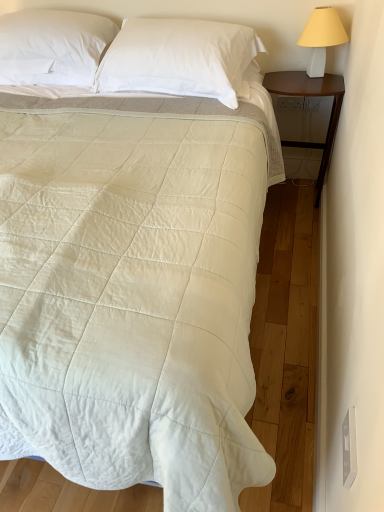
Question: From the image's perspective, is white smooth pillow at upper center, marked as the second pillow in a left-to-right arrangement, on white quilted fabric bed at center?

Choices:
 (A) yes
 (B) no

Answer: (A)

Question: From the image's perspective, is white smooth pillow at upper center, marked as the second pillow in a left-to-right arrangement, beneath white quilted fabric bed at center?

Choices:
 (A) no
 (B) yes

Answer: (A)

Question: Can you confirm if white smooth pillow at upper center, which ranks as the 1th pillow in right-to-left order, is taller than white quilted fabric bed at center?

Choices:
 (A) yes
 (B) no

Answer: (B)

Question: Does white smooth pillow at upper center, which ranks as the 1th pillow in right-to-left order, have a lesser height compared to white quilted fabric bed at center?

Choices:
 (A) yes
 (B) no

Answer: (A)

Question: Does white smooth pillow at upper center, marked as the second pillow in a left-to-right arrangement, have a smaller size compared to white quilted fabric bed at center?

Choices:
 (A) yes
 (B) no

Answer: (A)

Question: In terms of size, does white smooth pillow at upper center, acting as the second pillow starting from the right, appear bigger or smaller than white quilted fabric bed at center?

Choices:
 (A) small
 (B) big

Answer: (A)

Question: From the image's perspective, is white smooth pillow at upper center, acting as the second pillow starting from the right, positioned above or below white quilted fabric bed at center?

Choices:
 (A) above
 (B) below

Answer: (A)

Question: Is point (99, 55) closer or farther from the camera than point (183, 260)?

Choices:
 (A) farther
 (B) closer

Answer: (A)

Question: Would you say white smooth pillow at upper center, the first pillow in the left-to-right sequence, is inside or outside white quilted fabric bed at center?

Choices:
 (A) outside
 (B) inside

Answer: (A)

Question: From their relative heights in the image, would you say white ceramic lampshade at upper right is taller or shorter than white quilted fabric bed at center?

Choices:
 (A) tall
 (B) short

Answer: (B)

Question: Considering the positions of white ceramic lampshade at upper right and white quilted fabric bed at center in the image, is white ceramic lampshade at upper right wider or thinner than white quilted fabric bed at center?

Choices:
 (A) thin
 (B) wide

Answer: (A)

Question: Considering their positions, is white ceramic lampshade at upper right located in front of or behind white quilted fabric bed at center?

Choices:
 (A) behind
 (B) front

Answer: (A)

Question: Is white ceramic lampshade at upper right inside the boundaries of white quilted fabric bed at center, or outside?

Choices:
 (A) outside
 (B) inside

Answer: (A)

Question: Is white smooth pillow at upper center, marked as the second pillow in a left-to-right arrangement, in front of or behind white smooth pillow at upper center, acting as the second pillow starting from the right, in the image?

Choices:
 (A) behind
 (B) front

Answer: (B)

Question: Does point (150, 90) appear closer or farther from the camera than point (79, 69)?

Choices:
 (A) closer
 (B) farther

Answer: (A)